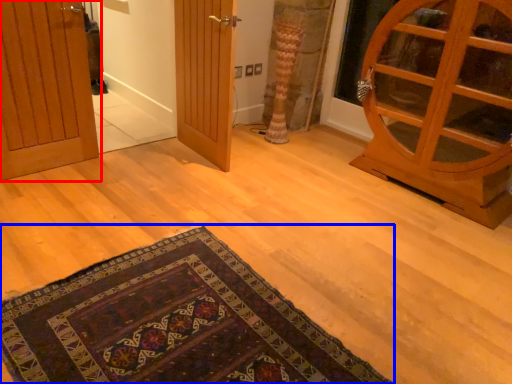
Question: Which object appears closest to the camera in this image, door (highlighted by a red box) or mat (highlighted by a blue box)?

Choices:
 (A) door
 (B) mat

Answer: (B)